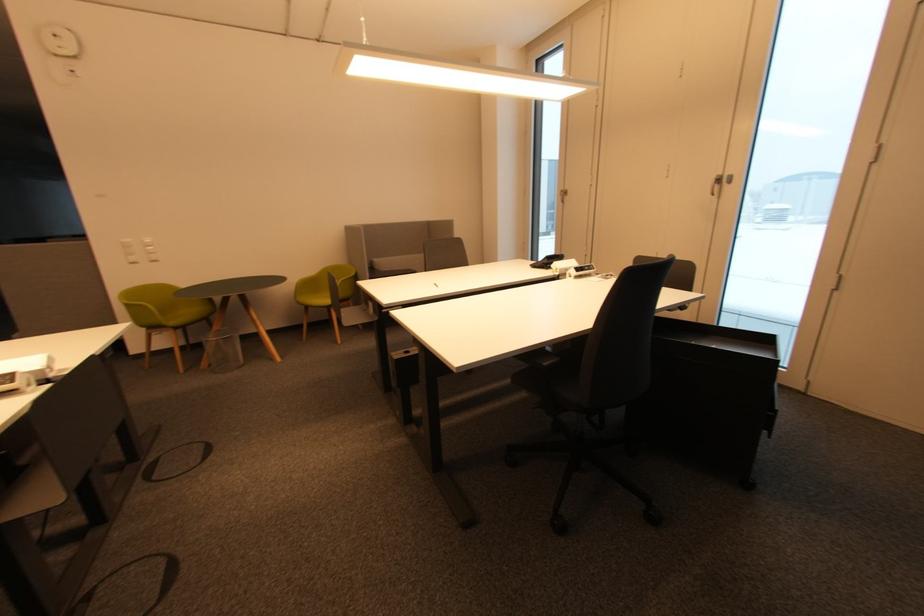
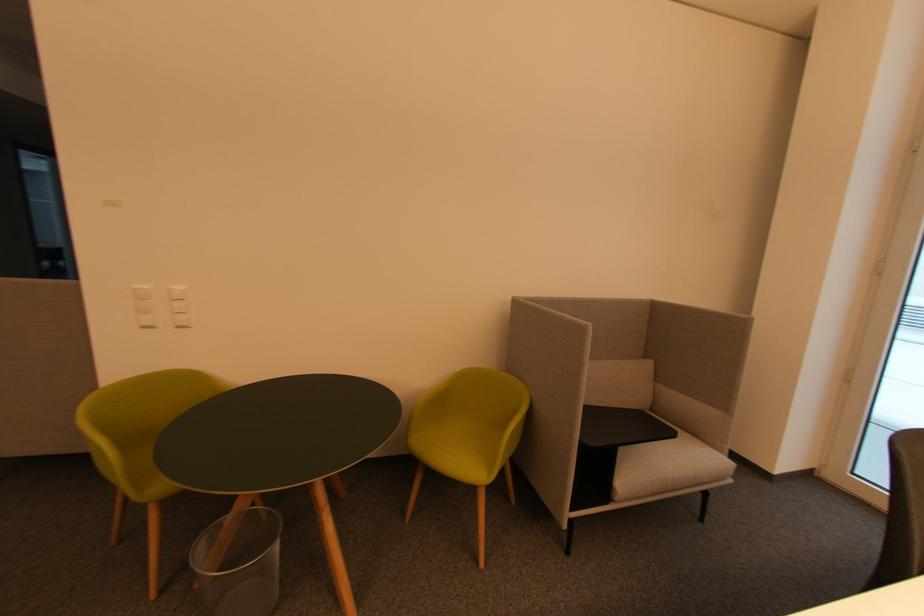
Which direction would the cameraman need to move to produce the second image?

The cameraman moved toward left, forward.